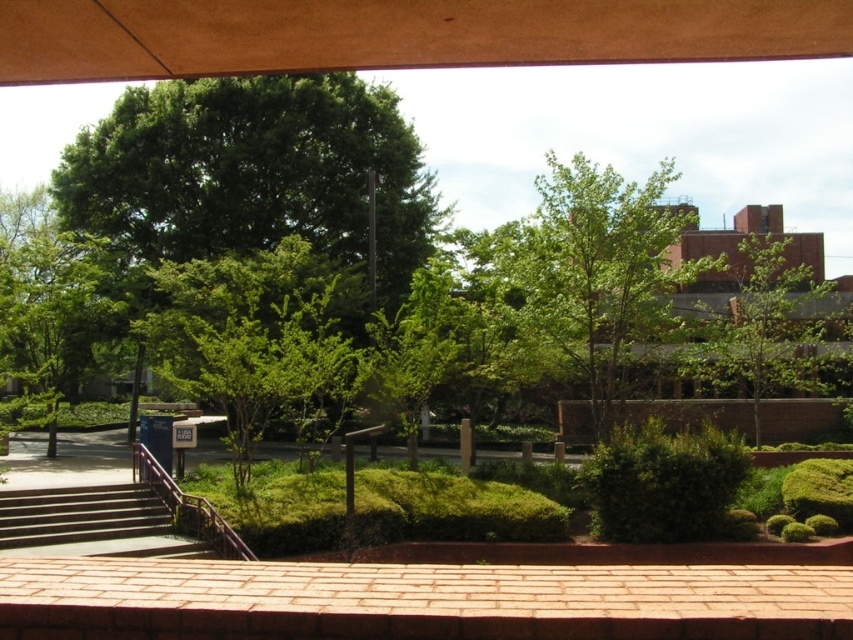
You are standing at the point marked by the coordinates point (527, 282) in the image. You want to throw a small ball to a friend who is standing exactly where you are. However, you need to ensure the ball travels a distance of at least 60 feet to reach them. Based on the scene description, is this possible?

The distance between point (527, 282) and the viewer is 59.30 feet. Since the required distance is at least 60 feet, the ball would not travel far enough to reach your friend.

From the picture: You are standing on the brick ledge in the foreground of the scene. You want to walk down to the garden area below. According to the coordinates provided, where exactly are the concrete stairs at lower left located?

The concrete stairs at lower left are located at coordinates point (x=91, y=524).

You are standing on a balcony and want to place a large potted plant between the green leafy bush at center and the purple metallic rail at lower left. Which object should you place it next to if you want the plant to fit better?

The green leafy bush at center has a larger width than the purple metallic rail at lower left, so placing the large potted plant next to the green leafy bush at center would provide more space for it to fit better.